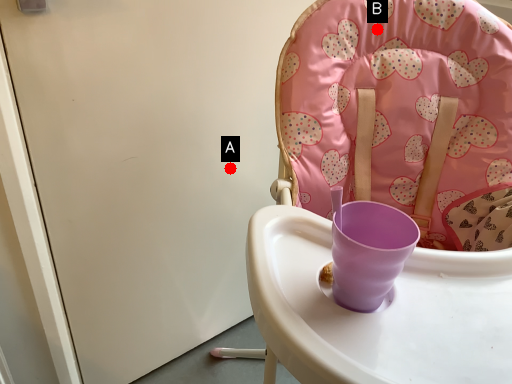
Question: Two points are circled on the image, labeled by A and B beside each circle. Which point is closer to the camera?

Choices:
 (A) A is closer
 (B) B is closer

Answer: (B)